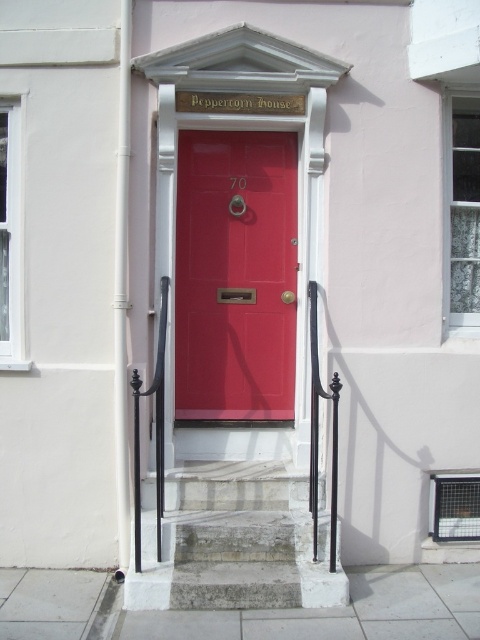
Question: Is matte red door at center further to the viewer compared to gray stone stairs at center?

Choices:
 (A) yes
 (B) no

Answer: (A)

Question: Can you confirm if matte red door at center is thinner than gray stone stairs at center?

Choices:
 (A) yes
 (B) no

Answer: (A)

Question: Does matte red door at center appear over gray stone stairs at center?

Choices:
 (A) no
 (B) yes

Answer: (B)

Question: Which of the following is the closest to the observer?

Choices:
 (A) matte red door at center
 (B) gray stone stairs at center

Answer: (B)

Question: Which object appears closest to the camera in this image?

Choices:
 (A) gray stone stairs at center
 (B) matte red door at center

Answer: (A)